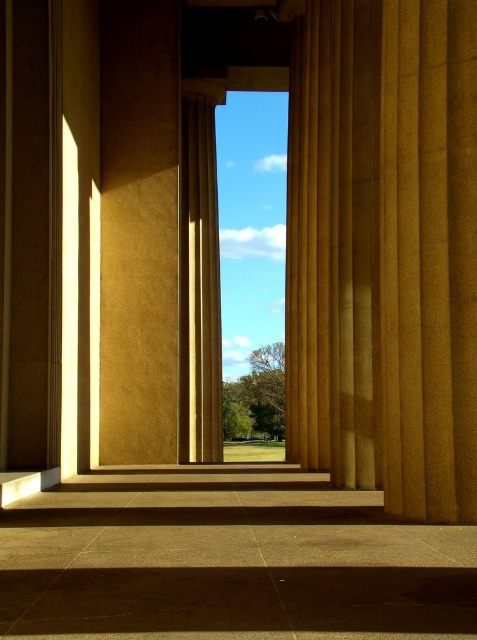
Question: Is golden stone pillar at center above matte gold column at center?

Choices:
 (A) no
 (B) yes

Answer: (A)

Question: Which point appears farthest from the camera in this image?

Choices:
 (A) (403, 394)
 (B) (188, 288)

Answer: (B)

Question: Does golden stone pillar at center lie behind matte gold column at center?

Choices:
 (A) yes
 (B) no

Answer: (B)

Question: Can you confirm if golden stone pillar at center is smaller than matte gold column at center?

Choices:
 (A) no
 (B) yes

Answer: (A)